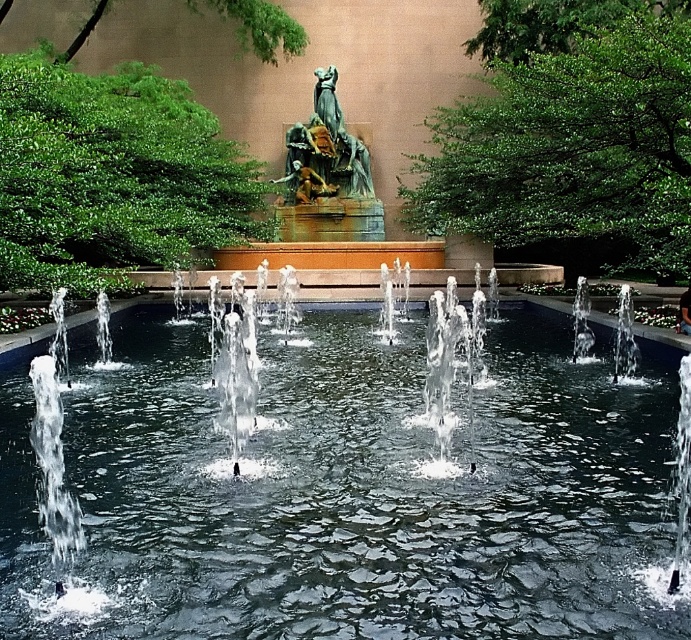
You are standing in front of the fountain and see the clear water at center and the bronze statue at center. Which object is located to the right of the other?

The clear water at center is positioned on the right side of bronze statue at center.